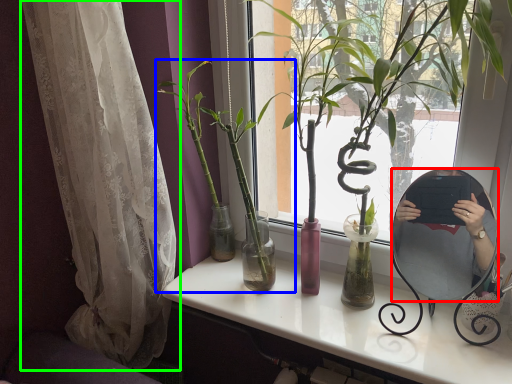
Question: Considering the real-world distances, which object is closest to mirror (highlighted by a red box)? houseplant (highlighted by a blue box) or curtain (highlighted by a green box).

Choices:
 (A) houseplant
 (B) curtain

Answer: (A)